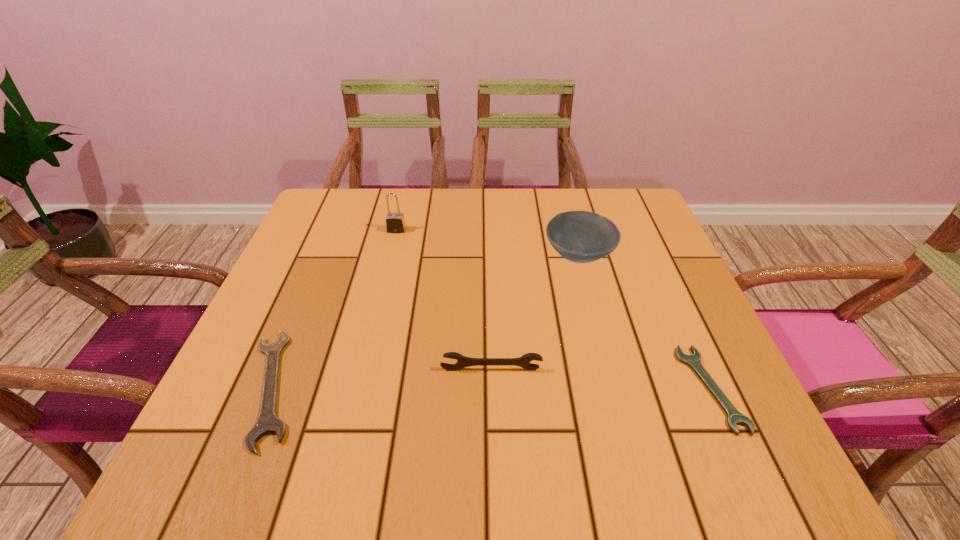
This screenshot has height=540, width=960. What are the coordinates of `free space between the second tallest wrench and the rightmost wrench` in the screenshot? It's located at (492, 388).

This screenshot has width=960, height=540. What are the coordinates of `vacant area that lies between the rightmost object and the second wrench from left to right` in the screenshot? It's located at (601, 379).

Locate an element on the screen. The image size is (960, 540). empty location between the second wrench from right to left and the second shortest wrench is located at coordinates (381, 379).

The image size is (960, 540). What are the coordinates of `free area in between the second farthest object and the rightmost wrench` in the screenshot? It's located at (645, 322).

Find the location of `vacant region between the second wrench from left to right and the shortest object`. vacant region between the second wrench from left to right and the shortest object is located at coordinates (601, 379).

You are a GUI agent. You are given a task and a screenshot of the screen. Output one action in this format:
    pyautogui.click(x=<x>, y=<y>)
    Task: Click on the unoccupied position between the shortest wrench and the second farthest object
    This screenshot has height=540, width=960.
    Given the screenshot: What is the action you would take?
    pyautogui.click(x=645, y=322)

Identify the location of vacant point located between the fourth object from right to left and the tallest wrench. Image resolution: width=960 pixels, height=540 pixels. (444, 300).

Locate an element on the screen. vacant space that is in between the second wrench from right to left and the shortest object is located at coordinates (601, 379).

Identify the location of free space between the fourth nearest object and the third tallest object. The image size is (960, 540). (535, 312).

Find the location of a particular element. The image size is (960, 540). the third closest object to the fourth shortest object is located at coordinates (395, 222).